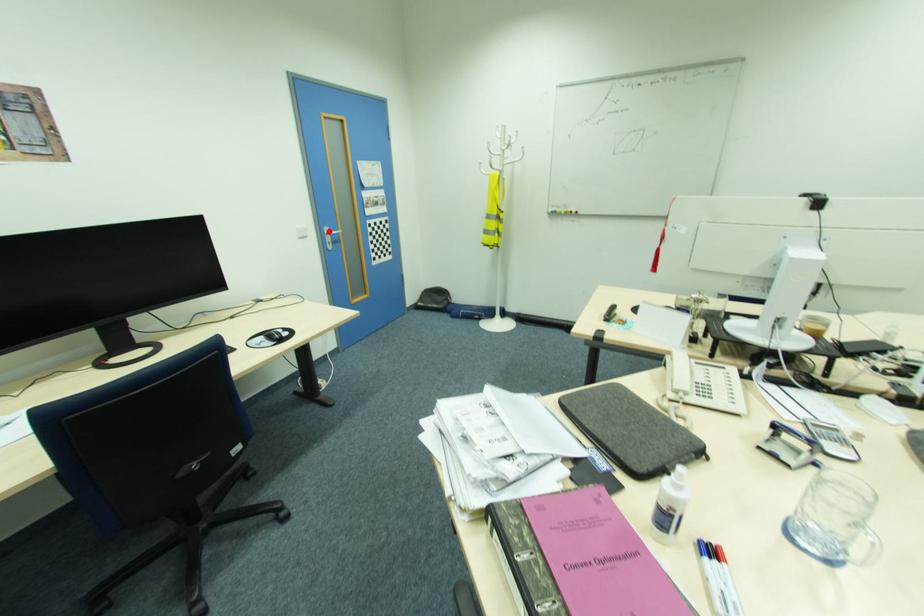
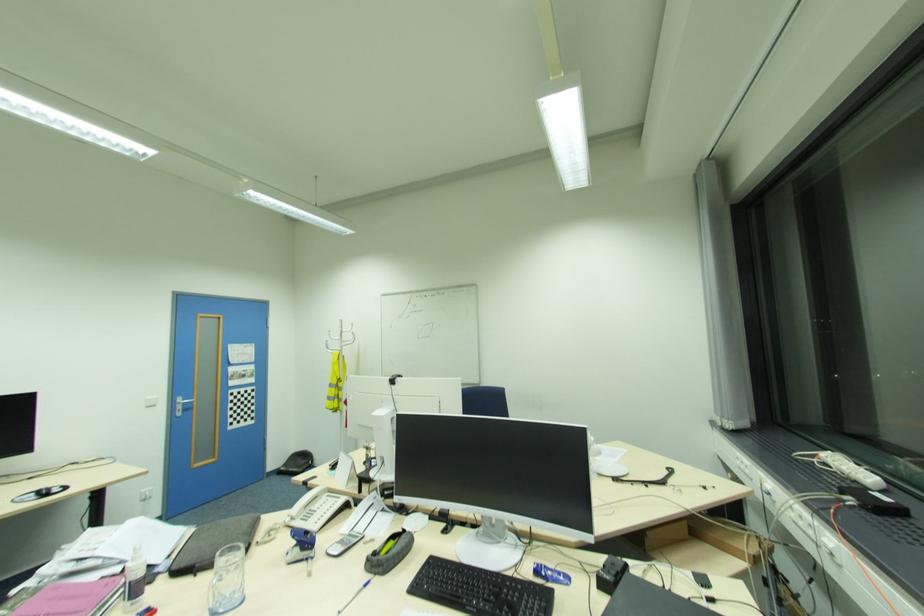
Where in the second image is the point corresponding to the highlighted location from the first image?

(180, 400)